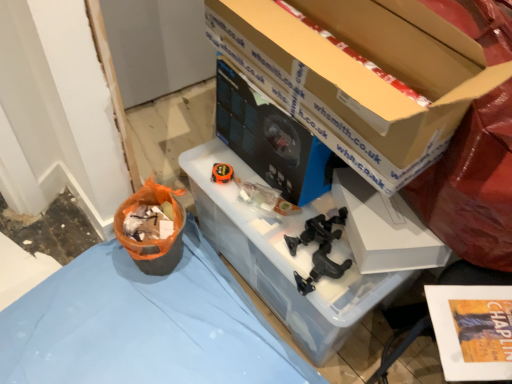
The height and width of the screenshot is (384, 512). What do you see at coordinates (222, 173) in the screenshot?
I see `orange rubber tape measure at center, the 2th toy positioned from the bottom` at bounding box center [222, 173].

The width and height of the screenshot is (512, 384). What do you see at coordinates (144, 325) in the screenshot?
I see `blue fabric at center` at bounding box center [144, 325].

What are the coordinates of `blue fabric at center` in the screenshot? It's located at (144, 325).

Describe the element at coordinates (319, 249) in the screenshot. I see `black plastic clamps at center, the second toy when ordered from top to bottom` at that location.

The image size is (512, 384). What are the coordinates of `orange rubber tape measure at center, which appears as the 2th toy when viewed from the front` in the screenshot? It's located at (222, 173).

Is black plastic clamps at center, the first toy from the front, spatially inside orange rubber tape measure at center, the second toy when ordered from right to left, or outside of it?

black plastic clamps at center, the first toy from the front, is not enclosed by orange rubber tape measure at center, the second toy when ordered from right to left.

From their relative heights in the image, would you say black plastic clamps at center, positioned as the first toy in right-to-left order, is taller or shorter than orange rubber tape measure at center, which appears as the 2th toy when viewed from the front?

Clearly, black plastic clamps at center, positioned as the first toy in right-to-left order, is taller compared to orange rubber tape measure at center, which appears as the 2th toy when viewed from the front.

You are a GUI agent. You are given a task and a screenshot of the screen. Output one action in this format:
    pyautogui.click(x=<x>, y=<y>)
    Task: Click on the toy to the right of orange rubber tape measure at center, placed as the first toy when sorted from back to front
    The image size is (512, 384).
    Given the screenshot: What is the action you would take?
    pyautogui.click(x=319, y=249)

Looking at the image, does blue fabric at center seem bigger or smaller compared to white matte box at center, which ranks as the 2th box in top-to-bottom order?

Considering their sizes, blue fabric at center takes up more space than white matte box at center, which ranks as the 2th box in top-to-bottom order.

Considering the sizes of blue fabric at center and white matte box at center, acting as the 1th box starting from the bottom, in the image, is blue fabric at center taller or shorter than white matte box at center, acting as the 1th box starting from the bottom,?

Clearly, blue fabric at center is shorter compared to white matte box at center, acting as the 1th box starting from the bottom.

Considering the positions of points (179, 315) and (376, 232), is point (179, 315) farther from camera compared to point (376, 232)?

Yes, point (179, 315) is farther from viewer.

Do you think blue fabric at center is within white matte box at center, acting as the 1th box starting from the bottom, or outside of it?

blue fabric at center is not enclosed by white matte box at center, acting as the 1th box starting from the bottom.

Which is correct: white matte box at center, which ranks as the 2th box in top-to-bottom order, is inside black plastic clamps at center, the first toy from the front, or outside of it?

The correct answer is: outside.

Considering the sizes of objects white matte box at center, acting as the 1th box starting from the bottom, and black plastic clamps at center, the first toy from the front, in the image provided, who is shorter, white matte box at center, acting as the 1th box starting from the bottom, or black plastic clamps at center, the first toy from the front,?

black plastic clamps at center, the first toy from the front, is shorter.

From a real-world perspective, is white matte box at center, which ranks as the 2th box in top-to-bottom order, positioned above or below black plastic clamps at center, the 2th toy positioned from the left?

white matte box at center, which ranks as the 2th box in top-to-bottom order, is situated higher than black plastic clamps at center, the 2th toy positioned from the left, in the real world.

This screenshot has height=384, width=512. I want to click on the 1st box in front of the black plastic clamps at center, positioned as the first toy in right-to-left order, so click(384, 228).

Considering the sizes of objects white matte box at center, acting as the 1th box starting from the bottom, and clear plastic storage box at center in the image provided, who is taller, white matte box at center, acting as the 1th box starting from the bottom, or clear plastic storage box at center?

clear plastic storage box at center is taller.

Looking at the image, does white matte box at center, acting as the 1th box starting from the bottom, seem bigger or smaller compared to clear plastic storage box at center?

Clearly, white matte box at center, acting as the 1th box starting from the bottom, is smaller in size than clear plastic storage box at center.

From the image's perspective, which is above, white matte box at center, which ranks as the 2th box in top-to-bottom order, or clear plastic storage box at center?

white matte box at center, which ranks as the 2th box in top-to-bottom order, appears higher in the image.

From a real-world perspective, who is located lower, blue fabric at center or cardboard box at upper center, the first box from the top?

From a 3D spatial view, blue fabric at center is below.

Visually, is blue fabric at center positioned to the left or to the right of cardboard box at upper center, which appears as the 2th box when ordered from the bottom?

In the image, blue fabric at center appears on the left side of cardboard box at upper center, which appears as the 2th box when ordered from the bottom.

Is cardboard box at upper center, the first box from the top, at the back of blue fabric at center?

blue fabric at center is not turned away from cardboard box at upper center, the first box from the top.

Is blue fabric at center next to cardboard box at upper center, the first box from the top, and touching it?

blue fabric at center and cardboard box at upper center, the first box from the top, are not in contact.

This screenshot has height=384, width=512. I want to click on desktop computer on the right of the blue fabric at center, so click(271, 139).

From the image's perspective, would you say blue fabric at center is shown under matte black desktop computer at center?

Yes.

Is blue fabric at center far from matte black desktop computer at center?

No, blue fabric at center is in close proximity to matte black desktop computer at center.

Is point (376, 225) more distant than point (227, 81)?

No, it is not.

From the image's perspective, which one is positioned lower, white matte box at center, acting as the 1th box starting from the bottom, or matte black desktop computer at center?

white matte box at center, acting as the 1th box starting from the bottom.

At what (x,y) coordinates should I click in order to perform the action: click on the 2nd box to the right when counting from the matte black desktop computer at center. Please return your answer as a coordinate pair (x, y). This screenshot has width=512, height=384. Looking at the image, I should click on (384, 228).

Looking at the image, does white matte box at center, which ranks as the 2th box in top-to-bottom order, seem bigger or smaller compared to matte black desktop computer at center?

In the image, white matte box at center, which ranks as the 2th box in top-to-bottom order, appears to be smaller than matte black desktop computer at center.

Image resolution: width=512 pixels, height=384 pixels. I want to click on toy below the black plastic clamps at center, positioned as the first toy in bottom-to-top order (from a real-world perspective), so click(222, 173).

There is a blue fabric at center. Identify the location of the 1st box above it (from the image's perspective). This screenshot has height=384, width=512. (384, 228).

Which object lies further to the anchor point cardboard box at upper center, which appears as the 2th box when ordered from the bottom, orange plastic basket at lower left or blue fabric at center?

Based on the image, blue fabric at center appears to be further to cardboard box at upper center, which appears as the 2th box when ordered from the bottom.

Which object lies nearer to the anchor point blue fabric at center, white matte box at center, which ranks as the 2th box in top-to-bottom order, or clear plastic storage box at center?

The object closer to blue fabric at center is clear plastic storage box at center.

Looking at the image, which one is located further to clear plastic storage box at center, black plastic clamps at center, positioned as the first toy in bottom-to-top order, or matte black desktop computer at center?

matte black desktop computer at center is positioned further to the anchor clear plastic storage box at center.

Based on their spatial positions, is matte black desktop computer at center or orange plastic basket at lower left further from clear plastic storage box at center?

orange plastic basket at lower left is positioned further to the anchor clear plastic storage box at center.

Looking at the image, which one is located further to blue fabric at center, black plastic clamps at center, which ranks as the 2th toy in back-to-front order, or orange rubber tape measure at center, which appears as the 2th toy when viewed from the front?

The object further to blue fabric at center is orange rubber tape measure at center, which appears as the 2th toy when viewed from the front.

Estimate the real-world distances between objects in this image. Which object is closer to matte black desktop computer at center, orange rubber tape measure at center, the 1th toy from the left, or cardboard box at upper center, which appears as the 2th box when ordered from the bottom?

cardboard box at upper center, which appears as the 2th box when ordered from the bottom, is positioned closer to the anchor matte black desktop computer at center.

Considering their positions, is matte black desktop computer at center positioned closer to orange plastic basket at lower left than cardboard box at upper center, the first box from the top?

Among the two, matte black desktop computer at center is located nearer to orange plastic basket at lower left.

From the image, which object appears to be farther from matte black desktop computer at center, orange plastic basket at lower left or orange rubber tape measure at center, which ranks as the 1th toy in top-to-bottom order?

orange plastic basket at lower left.

At what (x,y) coordinates should I click in order to perform the action: click on toy situated between clear plastic storage box at center and white matte box at center, acting as the 1th box starting from the bottom, from left to right. Please return your answer as a coordinate pair (x, y). The height and width of the screenshot is (384, 512). Looking at the image, I should click on (319, 249).

You are a GUI agent. You are given a task and a screenshot of the screen. Output one action in this format:
    pyautogui.click(x=<x>, y=<y>)
    Task: Click on the tablecloth between orange plastic basket at lower left and black plastic clamps at center, the first toy from the front
    
    Given the screenshot: What is the action you would take?
    click(144, 325)

Identify the location of box that lies between matte black desktop computer at center and blue fabric at center from top to bottom. (384, 228).

Where is `desktop computer between orange plastic basket at lower left and black plastic clamps at center, the 2th toy positioned from the left, from left to right`? The image size is (512, 384). desktop computer between orange plastic basket at lower left and black plastic clamps at center, the 2th toy positioned from the left, from left to right is located at coordinates (271, 139).